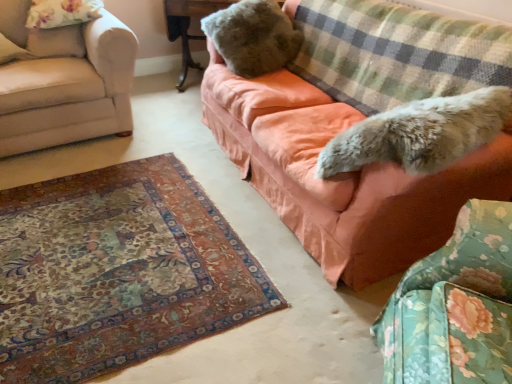
Question: In terms of height, does checkered fabric blanket at upper right look taller or shorter compared to beige fabric couch at left, which appears as the 1th studio couch when viewed from the left?

Choices:
 (A) short
 (B) tall

Answer: (A)

Question: Relative to beige fabric couch at left, the 2th studio couch in the right-to-left sequence, is checkered fabric blanket at upper right in front or behind?

Choices:
 (A) front
 (B) behind

Answer: (A)

Question: Which is farther from the beige fabric couch at left, which appears as the 1th studio couch when viewed from the left?

Choices:
 (A) fluffy fabric swivel chair at lower right
 (B) orange fabric couch at upper right, acting as the second studio couch starting from the left
 (C) floral fabric pillow at upper left
 (D) checkered fabric blanket at upper right
 (E) fuzzy beige paw at lower right

Answer: (A)

Question: Which object is positioned closest to the fuzzy brown teddy bear at upper center?

Choices:
 (A) fuzzy beige paw at lower right
 (B) orange fabric couch at upper right, acting as the second studio couch starting from the left
 (C) floral fabric pillow at upper left
 (D) wooden table at upper center
 (E) fluffy fabric swivel chair at lower right

Answer: (B)